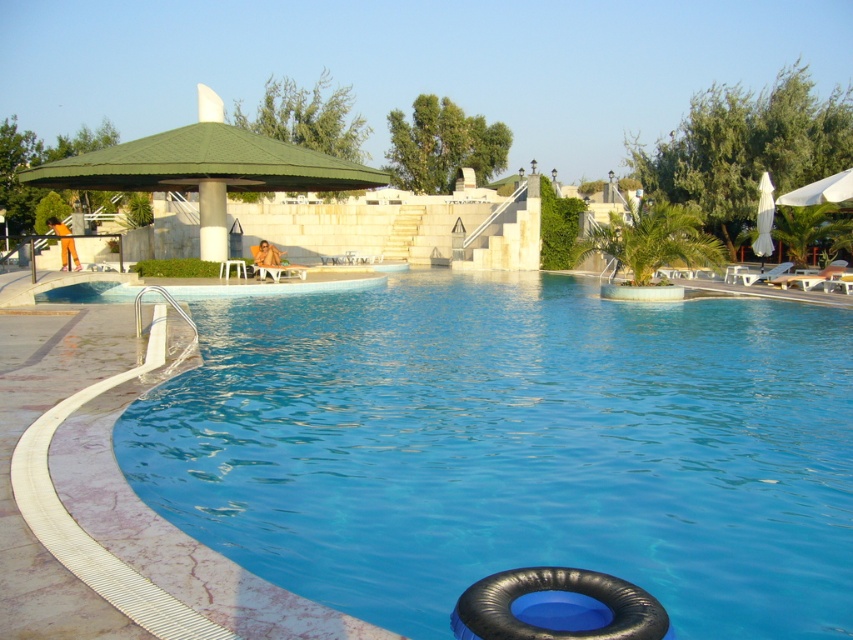
Question: Does blue rubber ring at lower center appear on the right side of white fabric umbrella at right?

Choices:
 (A) yes
 (B) no

Answer: (B)

Question: Where is blue rubber ring at lower center located in relation to white fabric umbrella at right in the image?

Choices:
 (A) below
 (B) above

Answer: (A)

Question: Is black rubber ring at lower center thinner than white fabric umbrella at right?

Choices:
 (A) no
 (B) yes

Answer: (A)

Question: Estimate the real-world distances between objects in this image. Which object is farther from the black rubber ring at lower center?

Choices:
 (A) blue rubber ring at lower center
 (B) white fabric umbrella at right

Answer: (B)

Question: Which of the following is the closest to the observer?

Choices:
 (A) black rubber ring at lower center
 (B) blue rubber ring at lower center

Answer: (A)

Question: Among these objects, which one is nearest to the camera?

Choices:
 (A) white fabric umbrella at right
 (B) black rubber ring at lower center
 (C) blue rubber ring at lower center

Answer: (B)